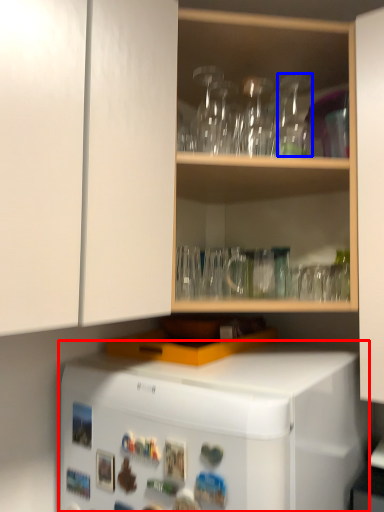
Question: Which point is further to the camera, refrigerator (highlighted by a red box) or glass vase (highlighted by a blue box)?

Choices:
 (A) refrigerator
 (B) glass vase

Answer: (B)